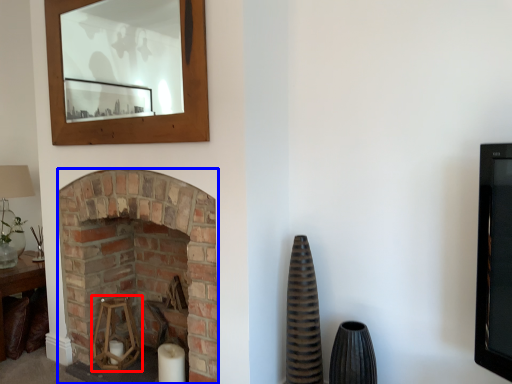
Question: Which object is further to the camera taking this photo, candle holder (highlighted by a red box) or fireplace (highlighted by a blue box)?

Choices:
 (A) candle holder
 (B) fireplace

Answer: (A)